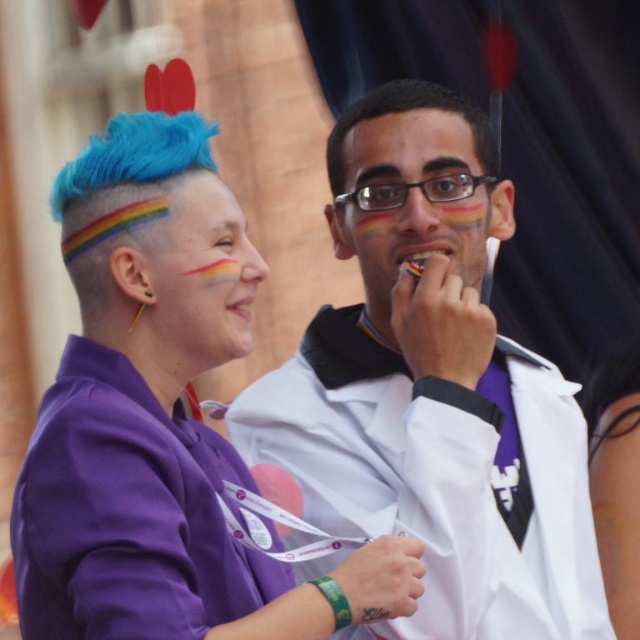
Based on the photo, you are organizing a costume party and need to decide which item takes up more space. You have the purple matte shirt at left and the purple fabric at center. Which one is larger?

The purple matte shirt at left is bigger than the purple fabric at center, so the purple matte shirt at left takes up more space.

You are a photographer at the event and need to adjust your camera settings to focus on the purple matte shirt at left and the purple fabric shirt at left. Which one is positioned higher on the person?

The purple matte shirt at left is above the purple fabric shirt at left, so the purple matte shirt at left is positioned higher on the person.